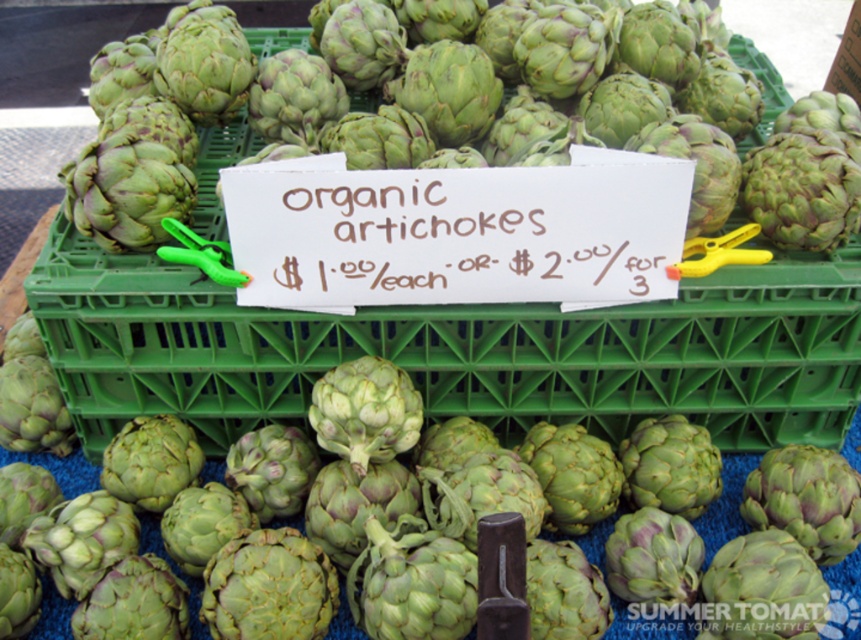
Question: Among these points, which one is farthest from the camera?

Choices:
 (A) (708, 284)
 (B) (858, 588)

Answer: (B)

Question: Is green plastic crate at center positioned at the back of green matte artichoke at center?

Choices:
 (A) no
 (B) yes

Answer: (B)

Question: Among these points, which one is farthest from the camera?

Choices:
 (A) (69, 611)
 (B) (577, 353)

Answer: (B)

Question: Is green plastic crate at center above green matte artichoke at center?

Choices:
 (A) yes
 (B) no

Answer: (A)

Question: Can you confirm if green plastic crate at center is positioned to the right of green matte artichoke at center?

Choices:
 (A) no
 (B) yes

Answer: (A)